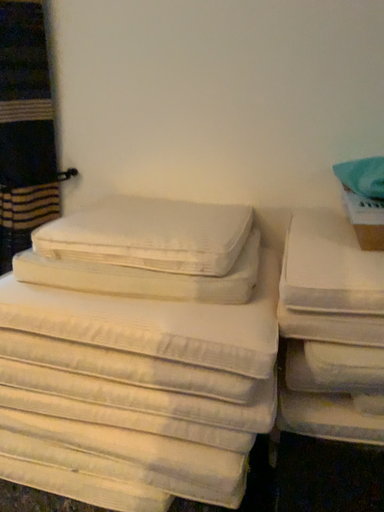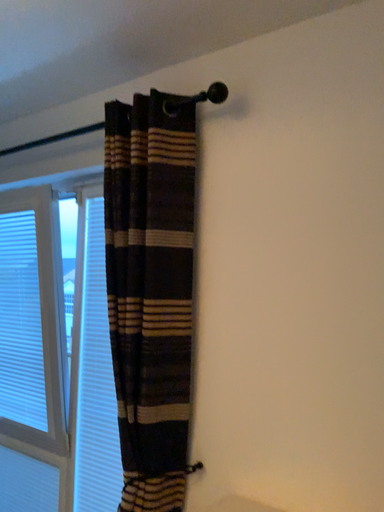
Question: How did the camera likely rotate when shooting the video?

Choices:
 (A) rotated left
 (B) rotated right

Answer: (A)